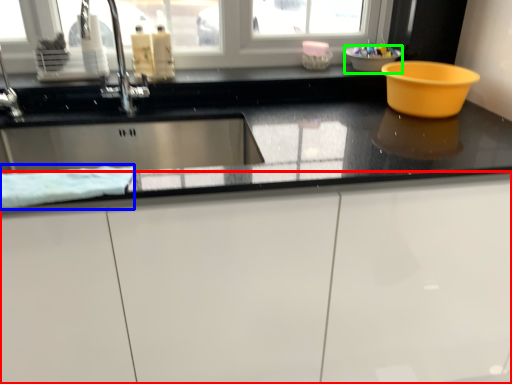
Question: Estimate the real-world distances between objects in this image. Which object is closer to cabinetry (highlighted by a red box), blanket (highlighted by a blue box) or basin (highlighted by a green box)?

Choices:
 (A) blanket
 (B) basin

Answer: (A)